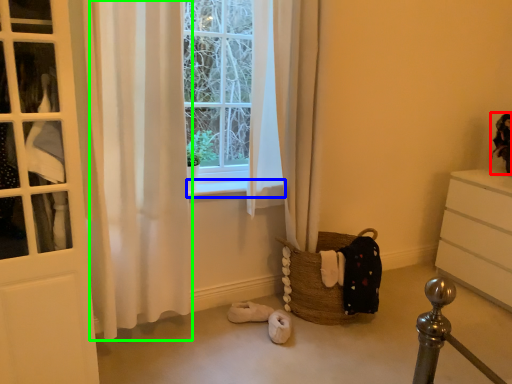
Question: Which object is the closest to the doll (highlighted by a red box)? Choose among these: window sill (highlighted by a blue box) or curtain (highlighted by a green box).

Choices:
 (A) window sill
 (B) curtain

Answer: (A)